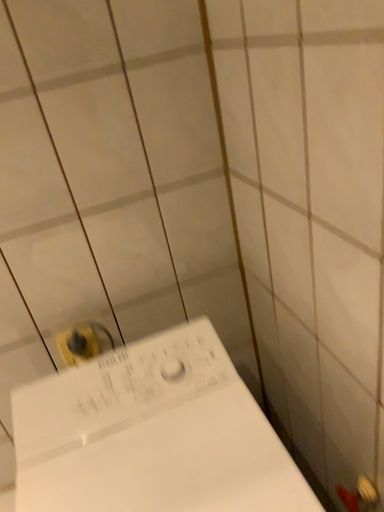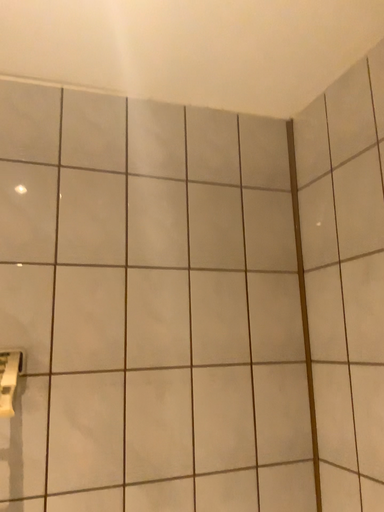
Question: Which way did the camera rotate in the video?

Choices:
 (A) rotated left
 (B) rotated right

Answer: (B)